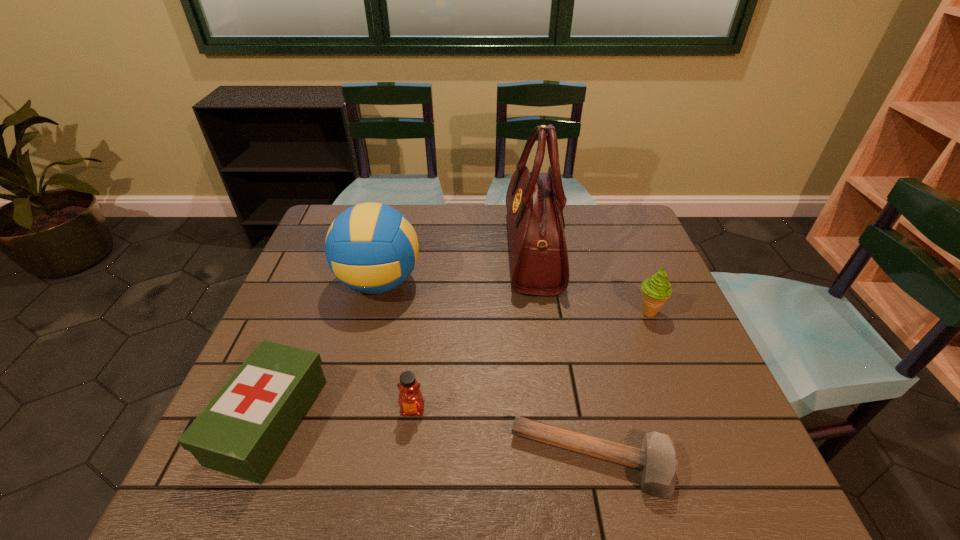
Identify the location of the tallest object. This screenshot has height=540, width=960. (539, 259).

At what (x,y) coordinates should I click in order to perform the action: click on the second tallest object. Please return your answer as a coordinate pair (x, y). The height and width of the screenshot is (540, 960). Looking at the image, I should click on (372, 248).

Find the location of `the rightmost object`. the rightmost object is located at coordinates (656, 290).

Identify the location of icecream. (656, 290).

Where is `honey`? honey is located at coordinates (411, 402).

The image size is (960, 540). What are the coordinates of `the first-aid kit` in the screenshot? It's located at (242, 431).

Where is `mallet`? mallet is located at coordinates pos(657,461).

The width and height of the screenshot is (960, 540). Identify the location of vacant region located 0.080m on the front-facing side of the handbag. [481, 251].

The width and height of the screenshot is (960, 540). What are the coordinates of `free spot located on the front-facing side of the handbag` in the screenshot? It's located at (465, 251).

Find the location of `free location located 0.240m on the front-facing side of the handbag`. free location located 0.240m on the front-facing side of the handbag is located at coordinates (428, 251).